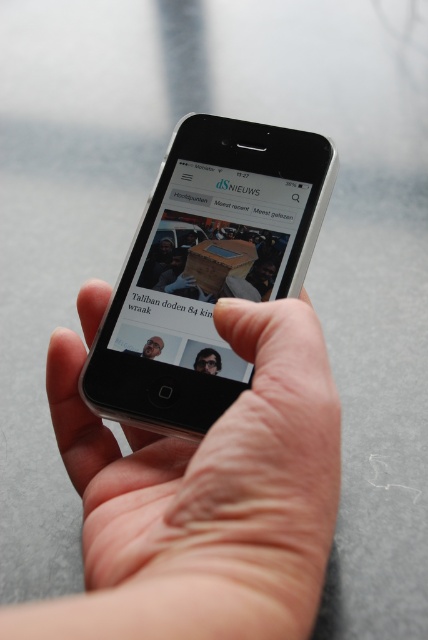
You are a delivery person who needs to place a small package between the skinny white hand at center and the smartphone. The package is 10 inches long. Can you fit it between them?

The distance between the skinny white hand at center and the smartphone is 10.43 inches. The package is 10 inches long, so it can fit between them with a small gap remaining.

You are a photographer trying to capture a closeup shot of the matte black glasses at center. The skinny white hand at center is holding the smartphone. Can the hand be positioned so that the glasses are fully visible in the frame without any part being covered?

The skinny white hand at center is wider than matte black glasses at center, so if the hand is holding the smartphone and positioned over the glasses, part of the glasses might be obscured. To ensure full visibility, reposition the hand to the side or adjust the angle so the hand doesn

You are a photographer trying to capture a closeup shot of the smartphone screen. The skinny white hand at center and the matte black glasses at center are in the way. Which object should you move to get a clearer view of the screen?

You should move the skinny white hand at center because it is taller than the matte black glasses at center and is blocking the screen.